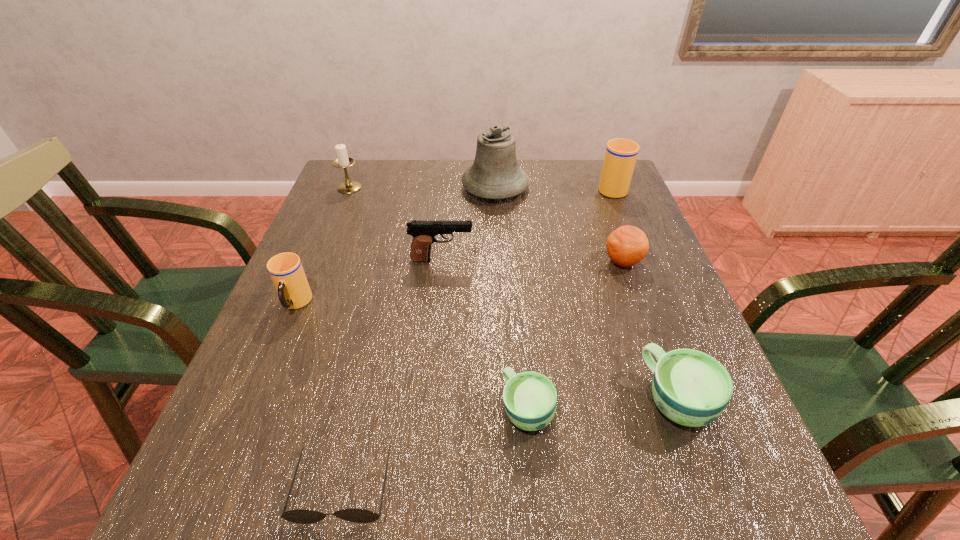
The image size is (960, 540). Identify the location of vacant region located 0.150m on the front of the orange. (644, 323).

This screenshot has height=540, width=960. What are the coordinates of `free space located on the left of the second shortest cup` in the screenshot? It's located at (480, 399).

Identify the location of free space located 0.350m on the left of the eighth tallest object. The image size is (960, 540). (300, 409).

Find the location of a particular element. Image resolution: width=960 pixels, height=540 pixels. bell that is at the far edge is located at coordinates (495, 174).

At what (x,y) coordinates should I click in order to perform the action: click on cup present at the far edge. Please return your answer as a coordinate pair (x, y). Looking at the image, I should click on (621, 154).

This screenshot has width=960, height=540. I want to click on candle holder at the far edge, so click(x=343, y=161).

The height and width of the screenshot is (540, 960). In order to click on object located at the near edge in this screenshot , I will do `click(299, 516)`.

Where is `candle holder that is at the left edge`? candle holder that is at the left edge is located at coordinates (343, 161).

At what (x,y) coordinates should I click in order to perform the action: click on cup that is positioned at the left edge. Please return your answer as a coordinate pair (x, y). Looking at the image, I should click on (286, 271).

This screenshot has width=960, height=540. I want to click on sunglasses situated at the left edge, so click(x=299, y=516).